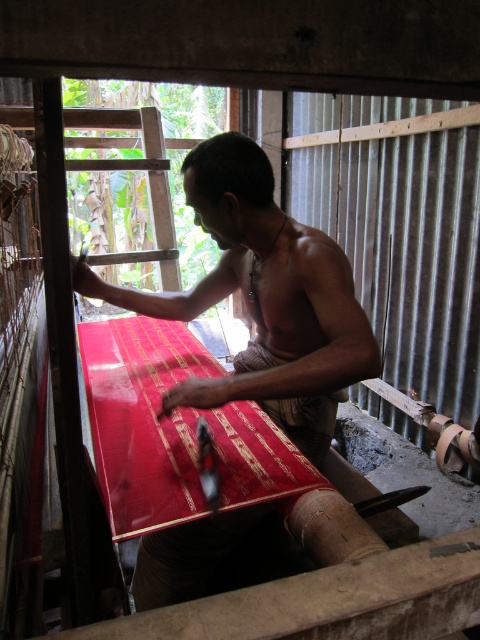
You are standing in the weaving workshop and want to reach both points. Which point, point [298,371] or point [255,404], will you reach first?

You will reach point [298,371] first because it is closer to you than point [255,404].

You are a customer looking to buy fabric for a large tapestry. You see both the smooth red fabric at center and the red silk fabric at center in the image. Which fabric would you choose if you want the one that covers more area?

The smooth red fabric at center has a larger size compared to the red silk fabric at center, so you should choose the smooth red fabric at center for a larger coverage area.